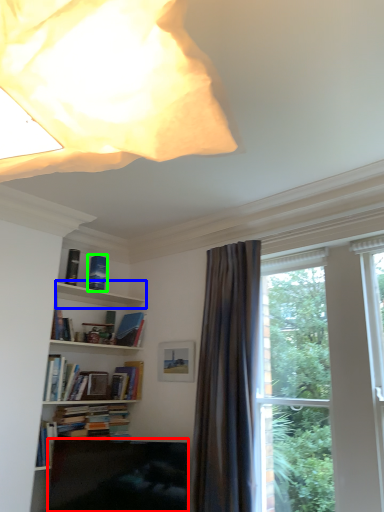
Question: Based on their relative distances, which object is farther from furniture (highlighted by a red box)? Choose from cabinet (highlighted by a blue box) and book (highlighted by a green box).

Choices:
 (A) cabinet
 (B) book

Answer: (B)